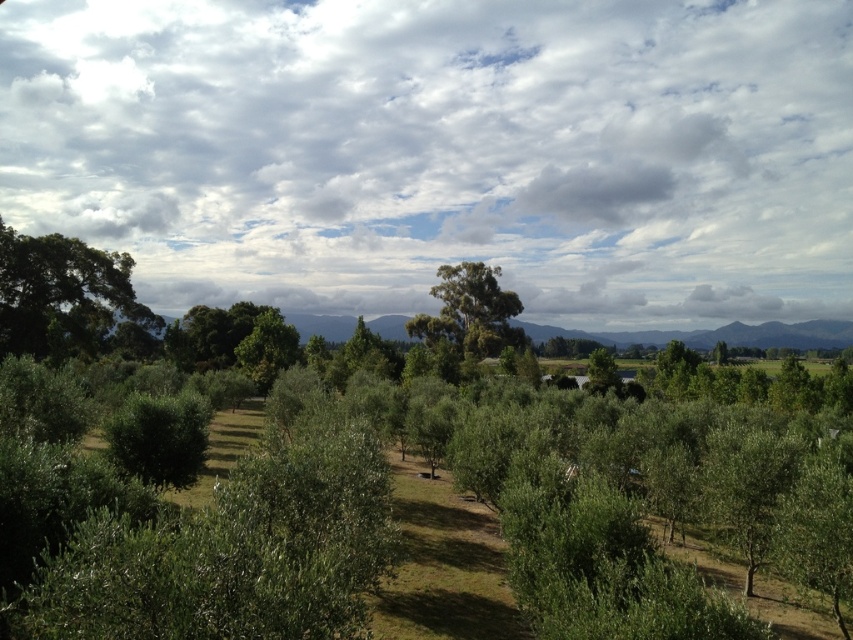
Looking at this image, does green leafy tree at left appear over green leafy tree at center?

Incorrect, green leafy tree at left is not positioned above green leafy tree at center.

Which is in front, point (10, 298) or point (466, 328)?

Point (10, 298) is in front.

The width and height of the screenshot is (853, 640). Describe the element at coordinates (62, 296) in the screenshot. I see `green leafy tree at left` at that location.

Find the location of a particular element. This screenshot has height=640, width=853. green leafy tree at left is located at coordinates (62, 296).

Can you confirm if cloudy sky at upper center is smaller than green leafy tree at center?

Actually, cloudy sky at upper center might be larger than green leafy tree at center.

Does cloudy sky at upper center appear on the right side of green leafy tree at center?

No, cloudy sky at upper center is not to the right of green leafy tree at center.

Locate an element on the screen. cloudy sky at upper center is located at coordinates (444, 150).

Locate an element on the screen. cloudy sky at upper center is located at coordinates (444, 150).

Between cloudy sky at upper center and green leafy tree at left, which one is positioned lower?

green leafy tree at left is lower down.

Describe the element at coordinates (444, 150) in the screenshot. The width and height of the screenshot is (853, 640). I see `cloudy sky at upper center` at that location.

What do you see at coordinates (444, 150) in the screenshot?
I see `cloudy sky at upper center` at bounding box center [444, 150].

Image resolution: width=853 pixels, height=640 pixels. I want to click on cloudy sky at upper center, so click(x=444, y=150).